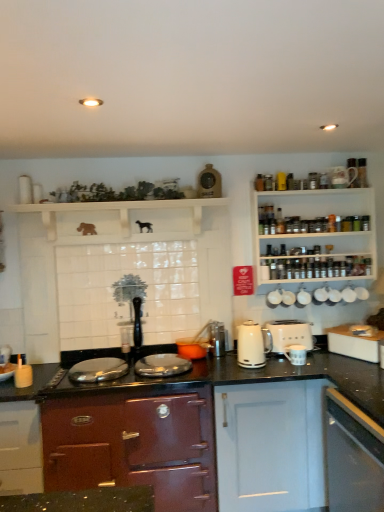
Identify the location of vacant region to the left of white glossy electric kettle at center. The width and height of the screenshot is (384, 512). (231, 368).